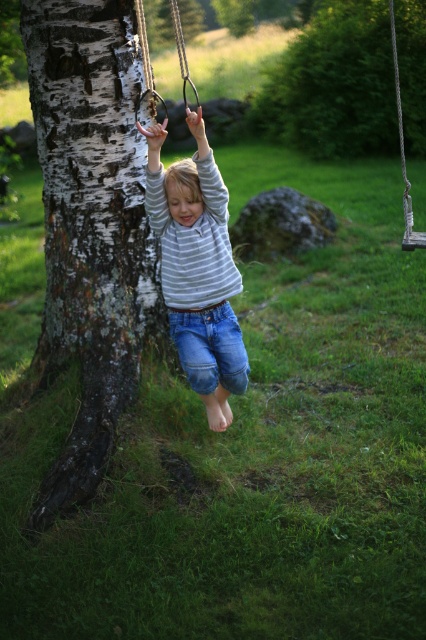
You are a parent watching your child play in the park. You see the white bark tree trunk at left and the striped cotton shirt at center. How far apart are these two objects?

The distance between the white bark tree trunk at left and the striped cotton shirt at center is 30.04 inches.

Based on the photo, you are standing at the origin point in the image. There are two points marked in the scene. Which point is closer to you, point (109, 225) or point (213, 314)?

Point (213, 314) is closer to you because it is in front of point (109, 225).

You are a photographer trying to capture the child swinging. You need to position yourself so that the striped cotton shirt at center is visible to the left of the rope swing at center. Is this possible given their current positions?

The striped cotton shirt at center is currently to the right of the rope swing at center, so positioning yourself to see it to the left would require moving to the opposite side of the swing where the shirt appears on the left.